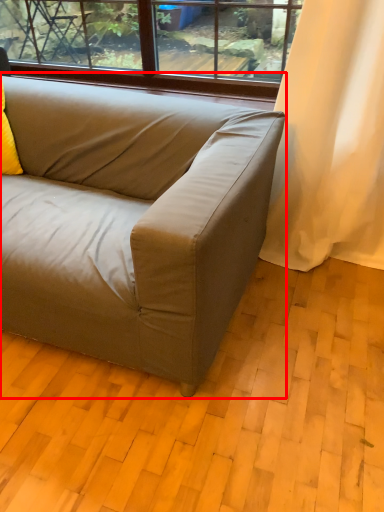
Question: From the image, what is the correct spatial relationship of studio couch (annotated by the red box) in relation to pillow?

Choices:
 (A) right
 (B) left

Answer: (A)